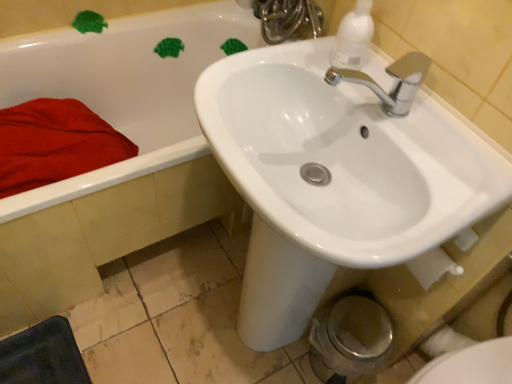
Find the location of a particular element. The width and height of the screenshot is (512, 384). free space to the left of white plastic soap dispenser at upper right is located at coordinates (290, 62).